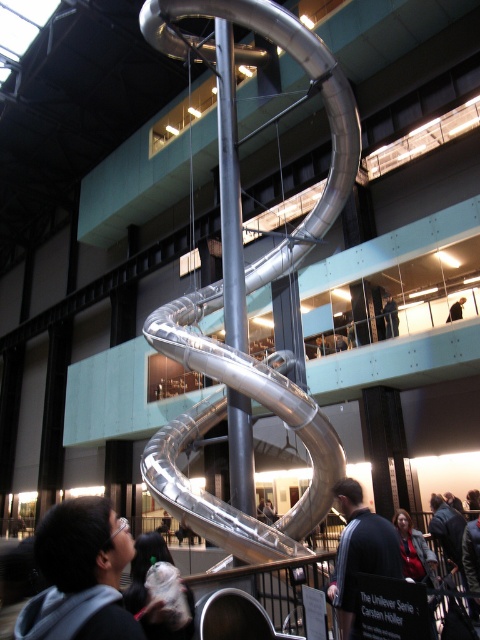
Is dark gray fabric jacket at center above white cotton hoodie at lower left?

Correct, dark gray fabric jacket at center is located above white cotton hoodie at lower left.

Between dark gray fabric jacket at center and white cotton hoodie at lower left, which one has more height?

dark gray fabric jacket at center is taller.

Is point (351, 512) farther from camera compared to point (141, 577)?

Yes, it is behind point (141, 577).

Locate an element on the screen. The image size is (480, 640). dark gray fabric jacket at center is located at coordinates (360, 552).

Describe the element at coordinates (415, 550) in the screenshot. I see `red sweater at lower right` at that location.

Is point (432, 561) closer to viewer compared to point (447, 320)?

Yes, it is.

Which is behind, point (430, 563) or point (458, 310)?

Point (458, 310)

At what (x,y) coordinates should I click in order to perform the action: click on red sweater at lower right. Please return your answer as a coordinate pair (x, y). Looking at the image, I should click on (415, 550).

Who is more forward, (x=358, y=566) or (x=394, y=312)?

Positioned in front is point (x=358, y=566).

Is the position of dark gray fabric jacket at center more distant than that of dark blue shirt at upper center?

That is False.

Does point (387, 548) come closer to viewer compared to point (384, 316)?

Yes, point (387, 548) is closer to viewer.

You are a GUI agent. You are given a task and a screenshot of the screen. Output one action in this format:
    pyautogui.click(x=<x>, y=<y>)
    Task: Click on the dark gray fabric jacket at center
    Image resolution: width=480 pixels, height=640 pixels.
    Given the screenshot: What is the action you would take?
    pyautogui.click(x=360, y=552)